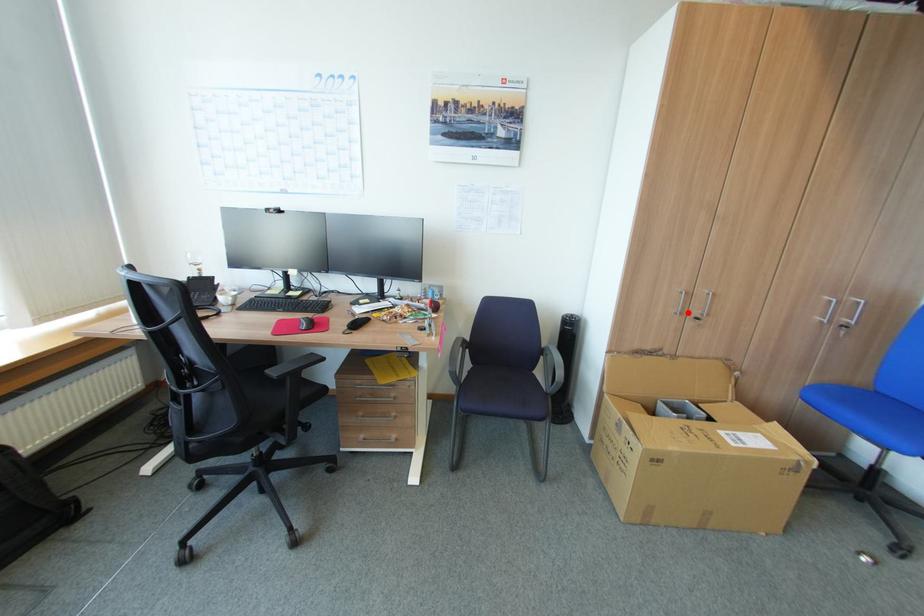
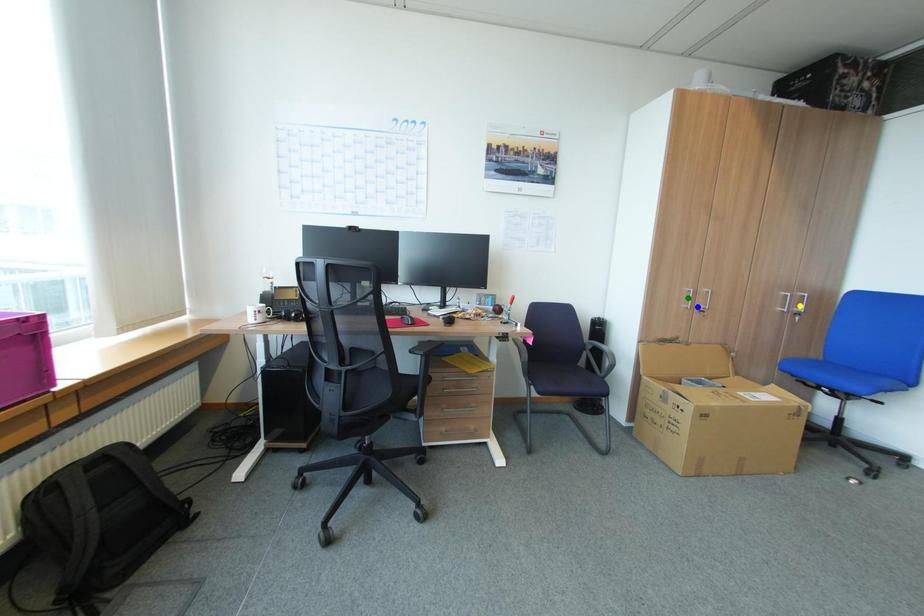
Question: I am providing you with two images of the same scene from different viewpoints. A red point is marked on the first image. You are given multiple points on the second image. Which mark in image 2 goes with the point in image 1?

Choices:
 (A) blue point
 (B) yellow point
 (C) green point

Answer: (A)